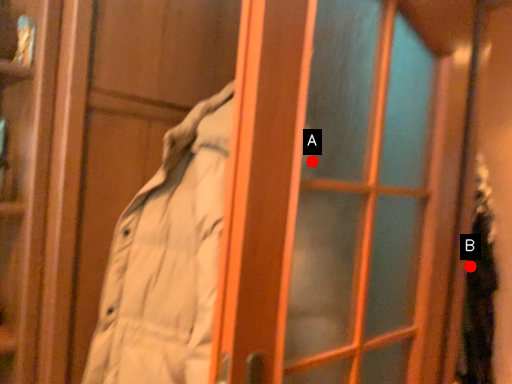
Question: Two points are circled on the image, labeled by A and B beside each circle. Which of the following is the closest to the observer?

Choices:
 (A) A is closer
 (B) B is closer

Answer: (A)